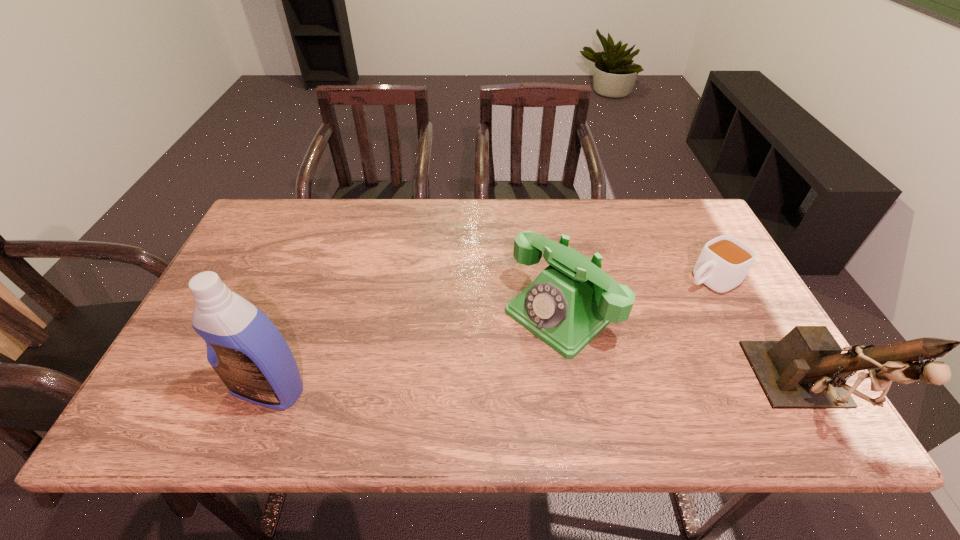
In the image, there is a desktop. Find the location of `vacant space at the left edge`. vacant space at the left edge is located at coordinates (269, 275).

At what (x,y) coordinates should I click in order to perform the action: click on free space at the right edge of the desktop. Please return your answer as a coordinate pair (x, y). This screenshot has height=540, width=960. Looking at the image, I should click on (739, 354).

In the image, there is a desktop. In order to click on blank space at the far right corner in this screenshot , I will do point(693,237).

Where is `vacant region between the leftmost object and the shortest object`? This screenshot has width=960, height=540. vacant region between the leftmost object and the shortest object is located at coordinates (x=490, y=334).

What are the coordinates of `empty location between the telephone and the figurine` in the screenshot? It's located at (684, 354).

Where is `free area in between the figurine and the cup`? This screenshot has width=960, height=540. free area in between the figurine and the cup is located at coordinates (757, 338).

Where is `vacant region between the figurine and the leftmost object`? The width and height of the screenshot is (960, 540). vacant region between the figurine and the leftmost object is located at coordinates (538, 392).

The image size is (960, 540). I want to click on empty location between the figurine and the leftmost object, so click(538, 392).

Where is `free spot between the detergent and the figurine`? free spot between the detergent and the figurine is located at coordinates pos(538,392).

Identify the location of free spot between the telephone and the leftmost object. Image resolution: width=960 pixels, height=540 pixels. (416, 350).